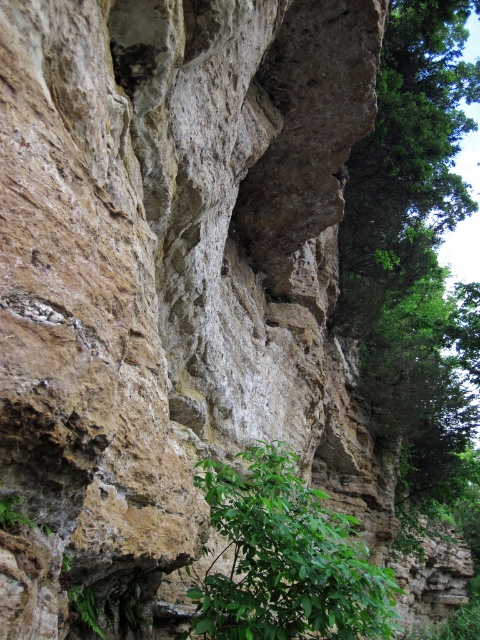
You are a botanist examining the image of the rocky cliff. The green leafy plant at lower center is crucial for your study. Can you determine its exact position relative to the center of the image using the coordinate system provided?

The green leafy plant at lower center is located at point (285,560), which means it is positioned to the right and slightly above the center of the image.

You are a hiker looking at the cliff face and want to know if the green leafy plant at lower center is positioned above or below the green leafy tree at upper right. According to the scene, what is the correct orientation?

The green leafy plant at lower center is located below the green leafy tree at upper right.

You are a hiker who wants to take a photo of both the green leafy plant at lower center and the green leafy tree at upper right in the same frame. Considering their sizes, which one should you zoom in on to ensure both fit in the photo?

The green leafy plant at lower center is smaller than the green leafy tree at upper right. To capture both in the same frame, you should zoom out to include the larger tree and the smaller plant together.